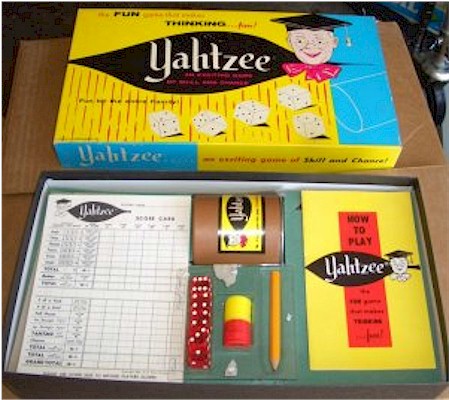
Locate an element on the screen. The image size is (449, 400). cardboard box is located at coordinates (28, 146).